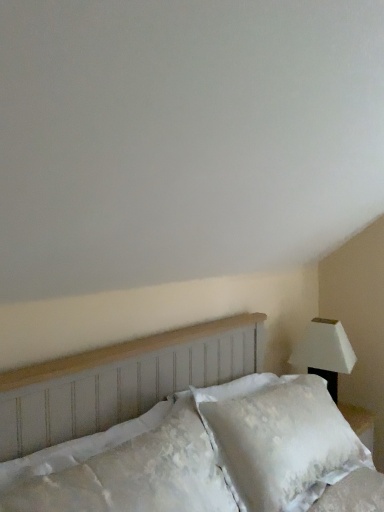
Locate an element on the screen. This screenshot has height=512, width=384. free point above white textured pillow at lower left (from a real-world perspective) is located at coordinates (112, 436).